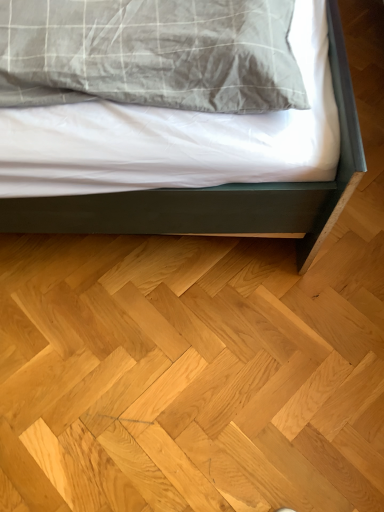
Image resolution: width=384 pixels, height=512 pixels. Find the location of `free point above natural wood floor at lower center (from a real-world perspective)`. free point above natural wood floor at lower center (from a real-world perspective) is located at coordinates 185,312.